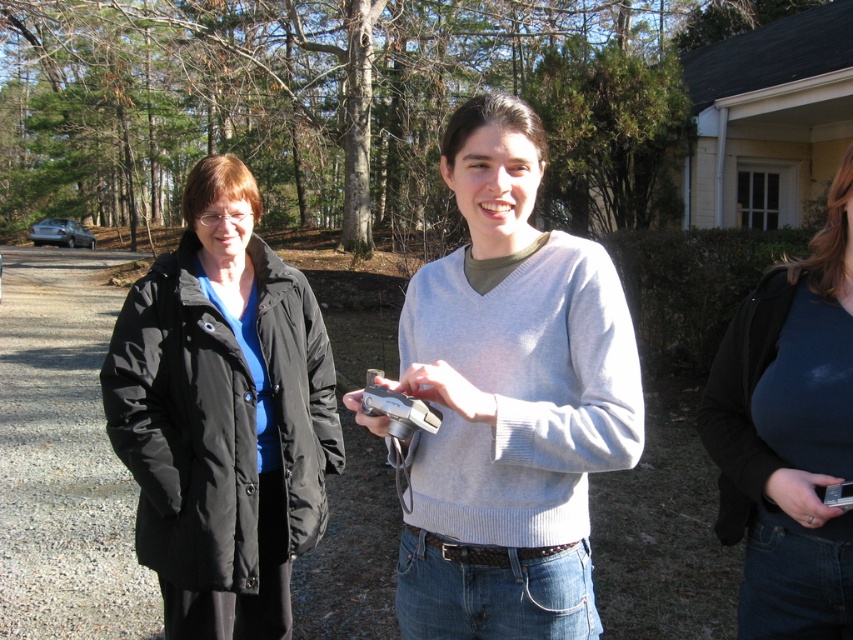
Based on the coordinates provided, which object is located at point (x=223, y=416)?

The point (x=223, y=416) marks the location of the black puffy coat at left.

You are standing in the scene and want to hand a small item to the person wearing the black puffy coat at left without moving closer. Can you do it by just reaching out your arm?

The black puffy coat at left and viewer are 2.31 meters apart. Since the average human arm length is about 0.7 meters, you cannot reach them without moving closer.

You are a delivery robot with a 1.2 meter wide package. You need to move between the black puffy coat at left and the dark blue jersey at center. Can you fit through the space between them?

The distance between the black puffy coat at left and the dark blue jersey at center is 1.38 meters. Since your package is 1.2 meters wide, you can fit through the space as 1.38 meters is wider than 1.2 meters.